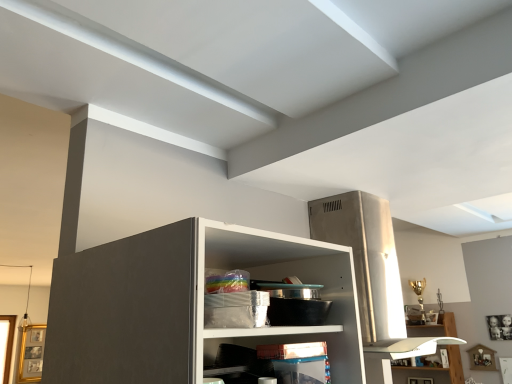
Question: Considering the relative sizes of translucent plastic container at lower center, which is the second shelf from right to left, and white glossy shelf at lower right, arranged as the 2th shelf when viewed from the left, in the image provided, is translucent plastic container at lower center, which is the second shelf from right to left, taller than white glossy shelf at lower right, arranged as the 2th shelf when viewed from the left,?

Choices:
 (A) no
 (B) yes

Answer: (A)

Question: Is translucent plastic container at lower center, the second shelf in the back-to-front sequence, at the right side of white glossy shelf at lower right, placed as the 1th shelf when sorted from right to left?

Choices:
 (A) no
 (B) yes

Answer: (A)

Question: Is translucent plastic container at lower center, the first shelf in the front-to-back sequence, not near white glossy shelf at lower right, which is the second shelf in front-to-back order?

Choices:
 (A) no
 (B) yes

Answer: (B)

Question: Is translucent plastic container at lower center, the first shelf in the front-to-back sequence, further to the viewer compared to white glossy shelf at lower right, the 1th shelf ordered from the bottom?

Choices:
 (A) yes
 (B) no

Answer: (B)

Question: Does translucent plastic container at lower center, which is the second shelf from right to left, lie in front of white glossy shelf at lower right, positioned as the 1th shelf in back-to-front order?

Choices:
 (A) no
 (B) yes

Answer: (B)

Question: From the image's perspective, is translucent plastic container at lower center, which is counted as the 1th shelf, starting from the left, beneath white glossy shelf at lower right, placed as the 1th shelf when sorted from right to left?

Choices:
 (A) yes
 (B) no

Answer: (B)

Question: Does white glossy shelf at lower right, positioned as the 1th shelf in back-to-front order, have a lesser height compared to translucent plastic container at lower center, which appears as the first shelf when viewed from the top?

Choices:
 (A) yes
 (B) no

Answer: (B)

Question: Is white glossy shelf at lower right, placed as the 1th shelf when sorted from right to left, wider than translucent plastic container at lower center, which appears as the 2th shelf when ordered from the bottom?

Choices:
 (A) no
 (B) yes

Answer: (A)

Question: Is white glossy shelf at lower right, which is the second shelf in front-to-back order, far from translucent plastic container at lower center, which is counted as the 1th shelf, starting from the left?

Choices:
 (A) no
 (B) yes

Answer: (B)

Question: Does white glossy shelf at lower right, placed as the 1th shelf when sorted from right to left, have a smaller size compared to translucent plastic container at lower center, which is counted as the 1th shelf, starting from the left?

Choices:
 (A) yes
 (B) no

Answer: (B)

Question: Is white glossy shelf at lower right, arranged as the 2th shelf when viewed from the left, next to translucent plastic container at lower center, the first shelf in the front-to-back sequence, and touching it?

Choices:
 (A) no
 (B) yes

Answer: (A)

Question: Considering the relative sizes of white glossy shelf at lower right, the 1th shelf ordered from the bottom, and translucent plastic container at lower center, the second shelf in the back-to-front sequence, in the image provided, is white glossy shelf at lower right, the 1th shelf ordered from the bottom, taller than translucent plastic container at lower center, the second shelf in the back-to-front sequence,?

Choices:
 (A) yes
 (B) no

Answer: (A)

Question: Do you think white glossy shelf at lower right, positioned as the 1th shelf in back-to-front order, is within translucent plastic container at lower center, which is counted as the 1th shelf, starting from the left, or outside of it?

Choices:
 (A) inside
 (B) outside

Answer: (B)